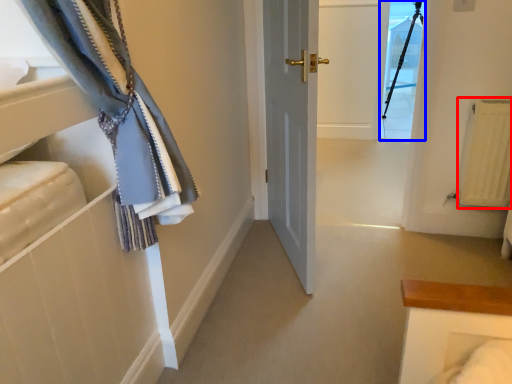
Question: Which of the following is the farthest to the observer, radiator (highlighted by a red box) or glass door (highlighted by a blue box)?

Choices:
 (A) radiator
 (B) glass door

Answer: (B)